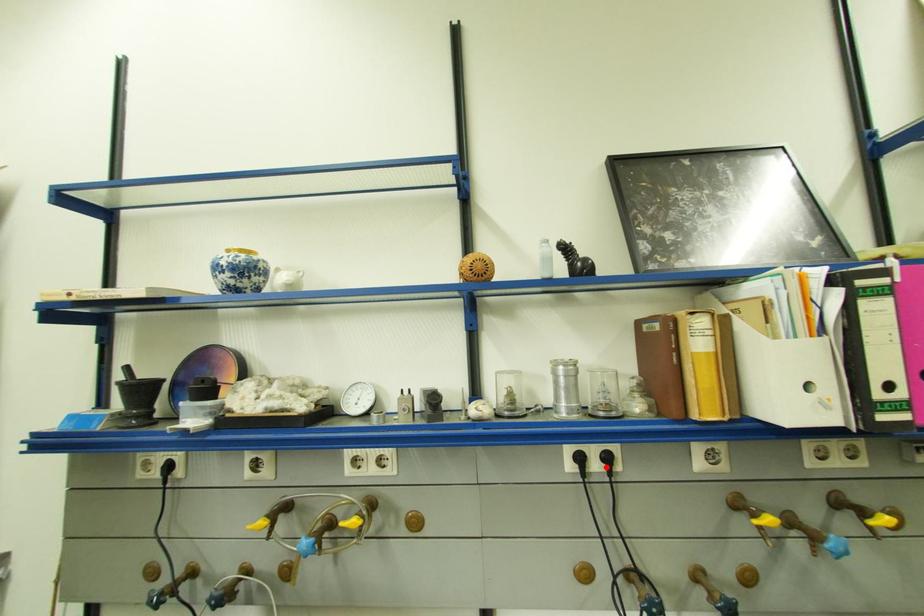
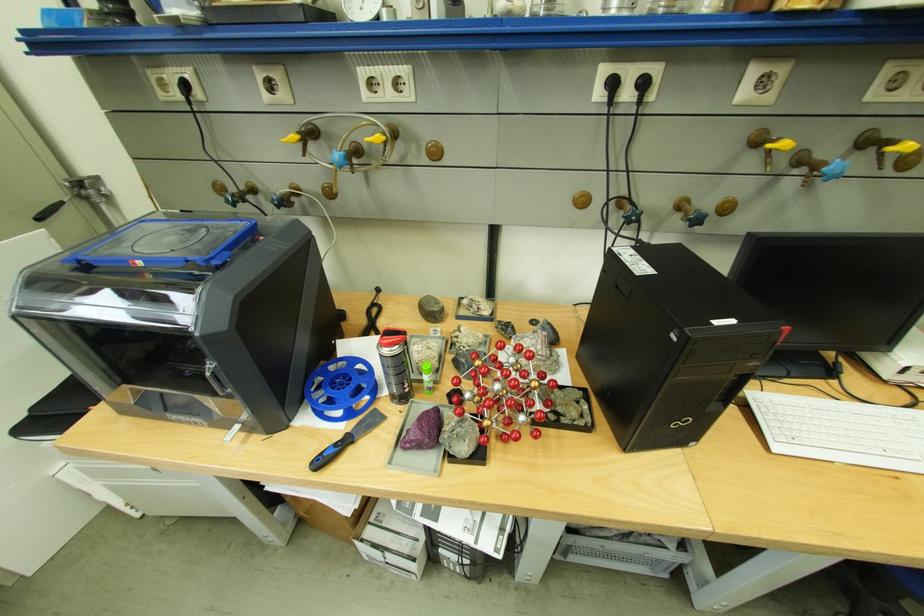
Find the pixel in the second image that matches the highlighted location in the first image.

(638, 95)